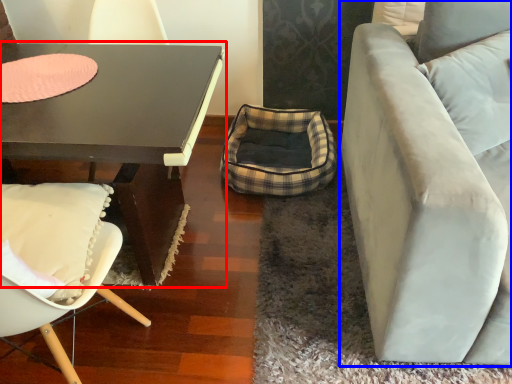
Question: Which point is further to the camera, coffee table (highlighted by a red box) or studio couch (highlighted by a blue box)?

Choices:
 (A) coffee table
 (B) studio couch

Answer: (A)